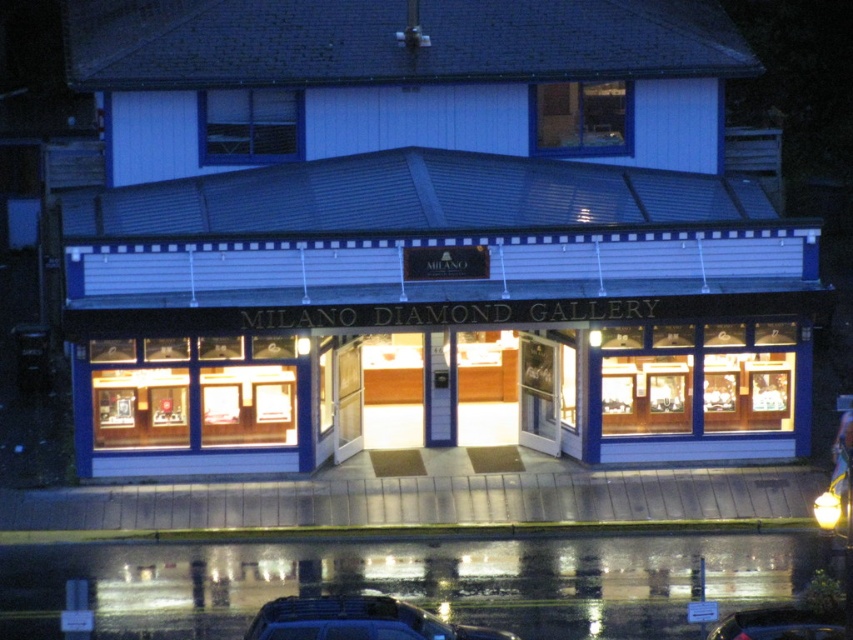
You are a photographer standing in front of the Milano Diamond Gallery at night. You notice two shiny black cars parked near the storefront. Which car is wider between the shiny black car at lower center and the shiny black car at lower right?

The shiny black car at lower center is wider than the shiny black car at lower right.

You are a delivery person who needs to park your van, which is 12 feet long, between the shiny black car at lower center and the shiny black car at lower right. Is there enough space between them for your van?

The distance between the shiny black car at lower center and the shiny black car at lower right is 10.15 feet. Since your van is 12 feet long, there isn not enough space to park between them.